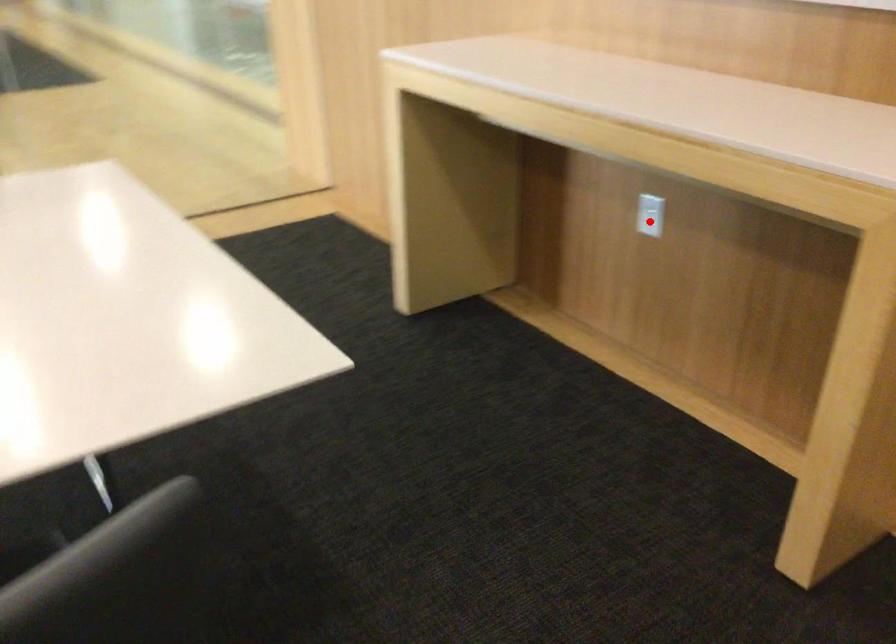
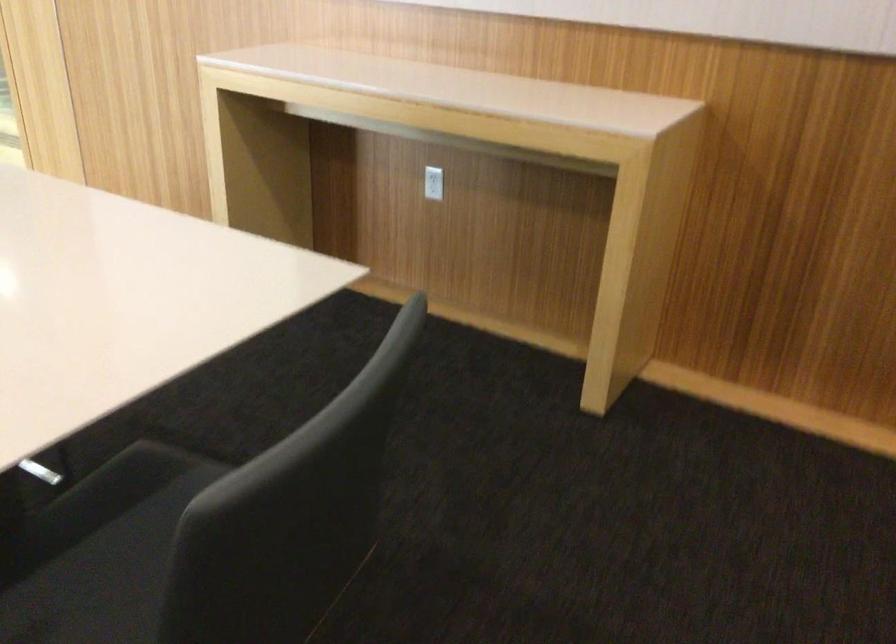
Question: I am providing you with two images of the same scene from different viewpoints. A red point is shown in image1. For the corresponding object point in image2, is it positioned nearer or farther from the camera?

Choices:
 (A) Nearer
 (B) Farther

Answer: (B)